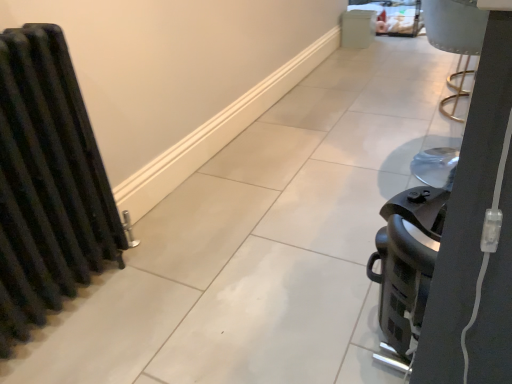
Question: Can you confirm if white matte cabinet at upper center, which ranks as the 2th appliance in left-to-right order, is bigger than black plastic coffee maker at right, the first appliance positioned from the left?

Choices:
 (A) no
 (B) yes

Answer: (A)

Question: Is white matte cabinet at upper center, which is counted as the first appliance, starting from the right, at the left side of black plastic coffee maker at right, which is the 2th appliance in right-to-left order?

Choices:
 (A) no
 (B) yes

Answer: (A)

Question: Could you tell me if white matte cabinet at upper center, the second appliance from the bottom, is facing black plastic coffee maker at right, marked as the 2th appliance in a back-to-front arrangement?

Choices:
 (A) yes
 (B) no

Answer: (B)

Question: Considering the relative sizes of white matte cabinet at upper center, which ranks as the first appliance in top-to-bottom order, and black plastic coffee maker at right, which is the 2th appliance in right-to-left order, in the image provided, is white matte cabinet at upper center, which ranks as the first appliance in top-to-bottom order, taller than black plastic coffee maker at right, which is the 2th appliance in right-to-left order,?

Choices:
 (A) yes
 (B) no

Answer: (B)

Question: Is white matte cabinet at upper center, arranged as the first appliance when viewed from the back, closer to the viewer compared to black plastic coffee maker at right, positioned as the 1th appliance in bottom-to-top order?

Choices:
 (A) no
 (B) yes

Answer: (A)

Question: Is white matte cabinet at upper center, arranged as the first appliance when viewed from the back, thinner than black plastic coffee maker at right, which is the 1th appliance in front-to-back order?

Choices:
 (A) yes
 (B) no

Answer: (A)

Question: Would you say black plastic coffee maker at right, positioned as the 1th appliance in bottom-to-top order, is outside black matte radiator at left?

Choices:
 (A) yes
 (B) no

Answer: (A)

Question: Is black plastic coffee maker at right, positioned as the 1th appliance in bottom-to-top order, touching black matte radiator at left?

Choices:
 (A) no
 (B) yes

Answer: (A)

Question: From a real-world perspective, is black plastic coffee maker at right, which is the 1th appliance in front-to-back order, under black matte radiator at left?

Choices:
 (A) no
 (B) yes

Answer: (B)

Question: Is black plastic coffee maker at right, which is the 2th appliance in right-to-left order, not near black matte radiator at left?

Choices:
 (A) no
 (B) yes

Answer: (A)

Question: From the image's perspective, is black plastic coffee maker at right, which is the 2th appliance in right-to-left order, on top of black matte radiator at left?

Choices:
 (A) no
 (B) yes

Answer: (A)

Question: Does black plastic coffee maker at right, which is the 2th appliance in right-to-left order, have a smaller size compared to black matte radiator at left?

Choices:
 (A) no
 (B) yes

Answer: (B)

Question: Is black plastic coffee maker at right, positioned as the 1th appliance in bottom-to-top order, surrounded by black matte radiator at left?

Choices:
 (A) yes
 (B) no

Answer: (B)